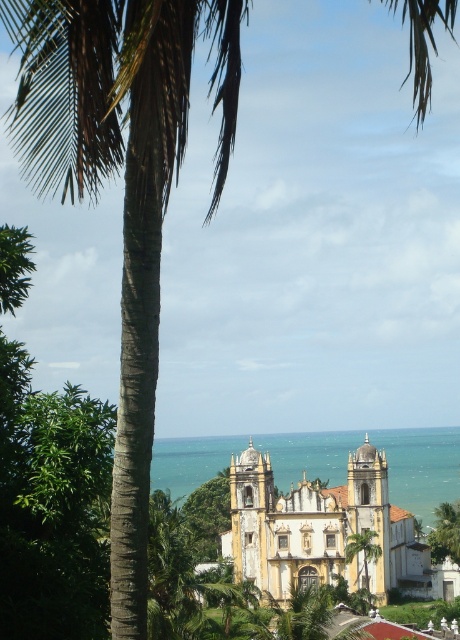
You are standing on the beach and see the yellow matte church at center and the blue water at center. Which one appears taller from your viewpoint?

The yellow matte church at center appears taller than the blue water at center because it has a greater height compared to the blue water at center.

You are standing on the beach and see the yellow matte church at center and the blue water at center. Which object is positioned to the left of the other?

The blue water at center is to the left of the yellow matte church at center because the church is to the right of the water.